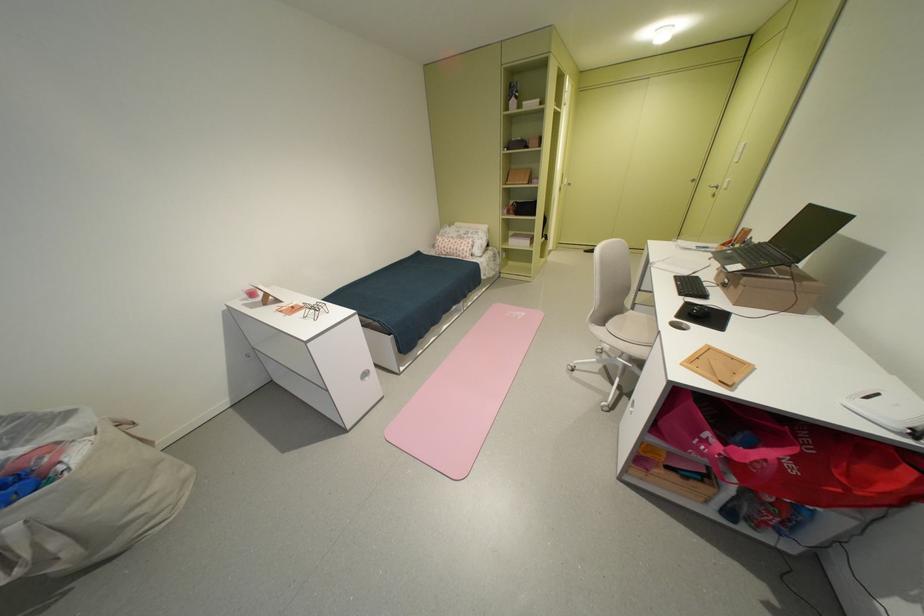
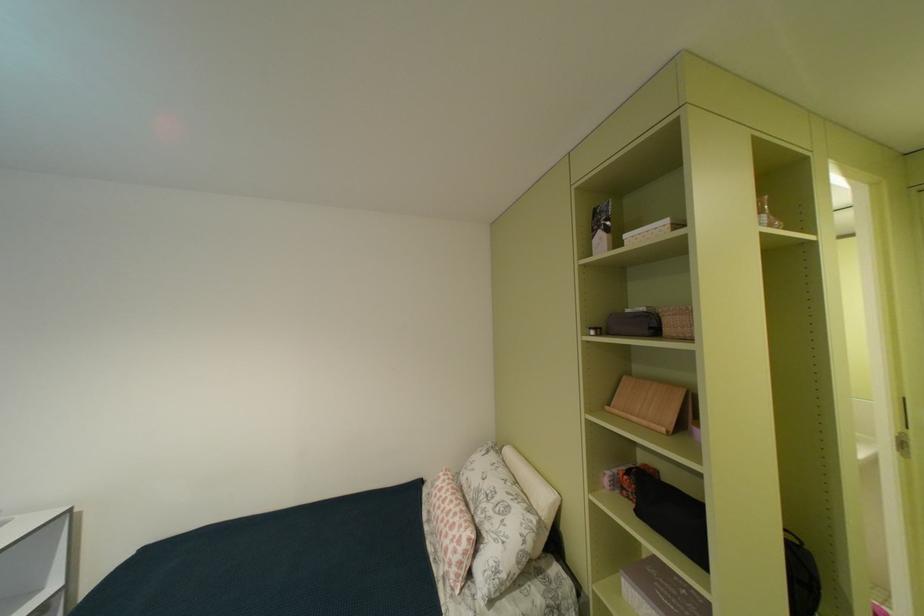
Where in the second image is the point corresponding to [475,251] from the first image?

(458, 556)